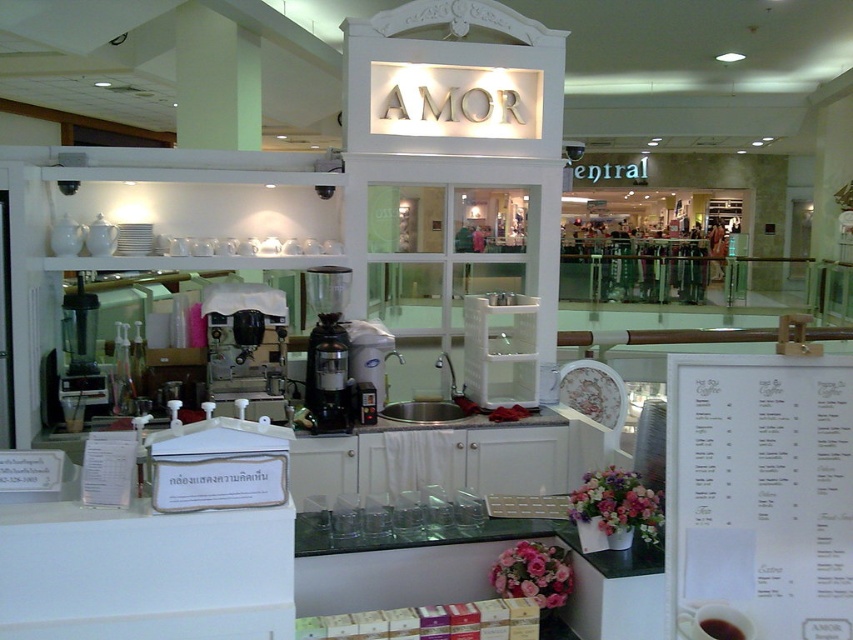
Question: Which of the following is the closest to the observer?

Choices:
 (A) black glossy cup at lower right
 (B) white paper menu at center
 (C) black matte cup at center
 (D) matte black blender at left

Answer: (A)

Question: Which point is farther to the camera?

Choices:
 (A) white paper menu at center
 (B) black matte cup at center
 (C) black matte coffee grinder at center
 (D) black glossy cup at lower right

Answer: (C)

Question: In this image, where is white paper menu at center located relative to black glossy cup at lower right?

Choices:
 (A) right
 (B) left

Answer: (A)

Question: Is matte black blender at left positioned at the back of black matte cup at center?

Choices:
 (A) no
 (B) yes

Answer: (B)

Question: Which point appears farthest from the camera in this image?

Choices:
 (A) (85, 352)
 (B) (724, 605)

Answer: (A)

Question: Is matte black blender at left thinner than black matte cup at center?

Choices:
 (A) yes
 (B) no

Answer: (B)